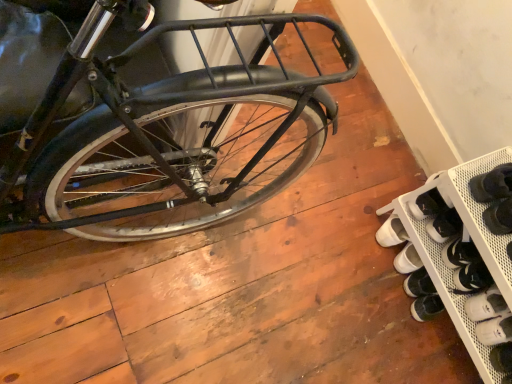
Find the location of a particular element. vacant area that is in front of white mesh shoe rack at lower right is located at coordinates (360, 328).